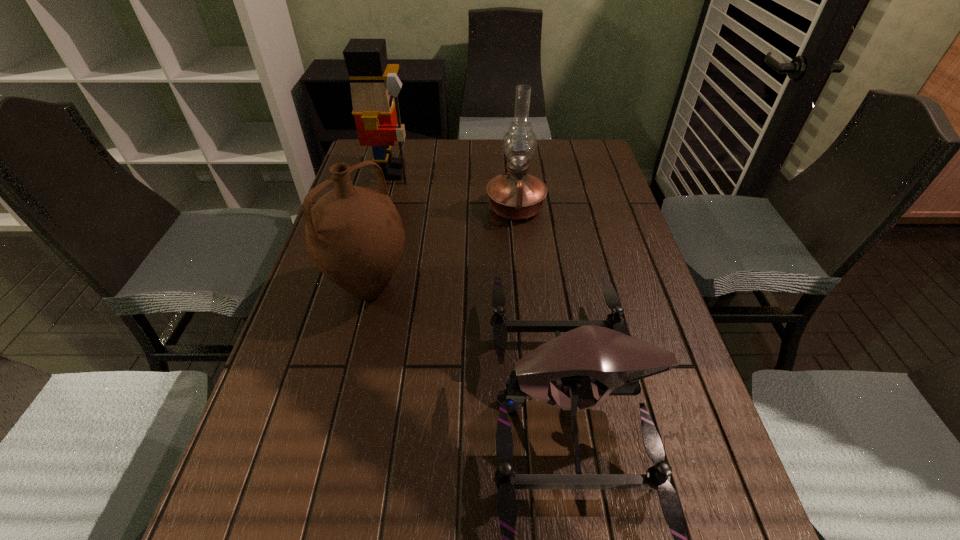
I want to click on nutcracker, so (x=375, y=86).

This screenshot has height=540, width=960. I want to click on the third nearest object, so click(516, 195).

Identify the location of pitcher. (355, 236).

Image resolution: width=960 pixels, height=540 pixels. What are the coordinates of `free space located in front of the farthest object holding the staff` in the screenshot? It's located at (483, 172).

Where is `vacant space situated 0.390m on the left of the third nearest object`? Image resolution: width=960 pixels, height=540 pixels. vacant space situated 0.390m on the left of the third nearest object is located at coordinates (360, 208).

Find the location of `blank area located on the right of the pitcher`. blank area located on the right of the pitcher is located at coordinates (557, 288).

I want to click on object that is at the far edge, so click(x=375, y=86).

Where is `nutcracker that is positioned at the left edge`? nutcracker that is positioned at the left edge is located at coordinates (375, 86).

This screenshot has width=960, height=540. I want to click on pitcher that is at the left edge, so click(x=355, y=236).

Identify the location of object positioned at the far left corner. The image size is (960, 540). (375, 86).